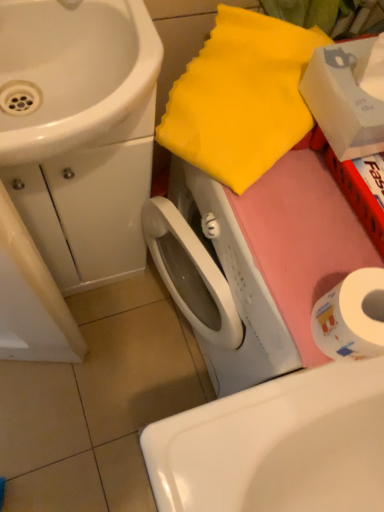
At what (x,y) coordinates should I click in order to perform the action: click on free space that is to the left of white paper at lower right. Please return your answer as a coordinate pair (x, y). Looking at the image, I should click on (269, 264).